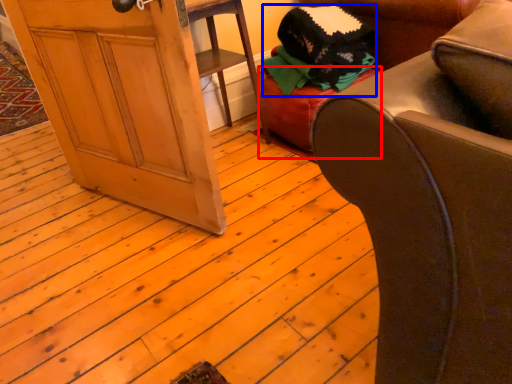
Question: Which point is closer to the camera, stool (highlighted by a red box) or clothing (highlighted by a blue box)?

Choices:
 (A) stool
 (B) clothing

Answer: (B)